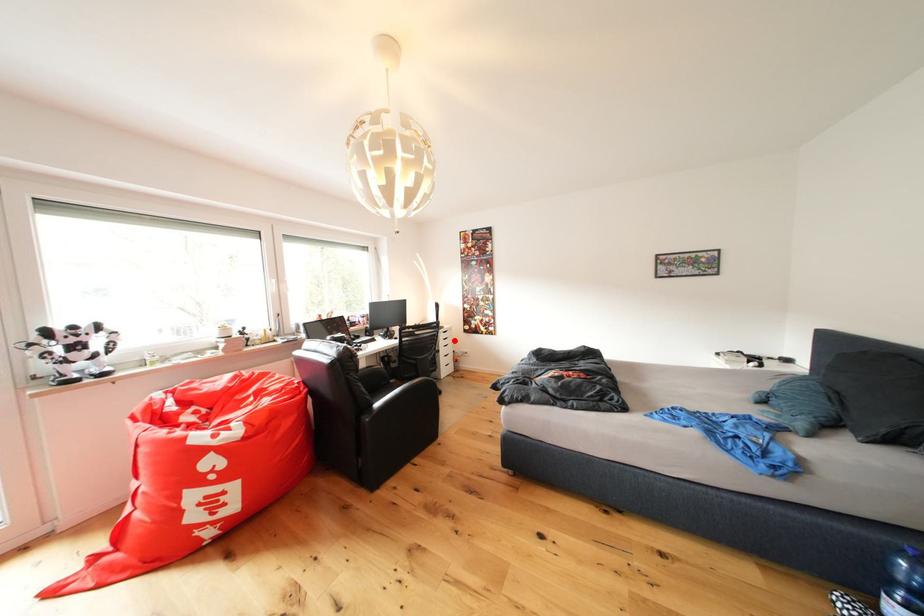
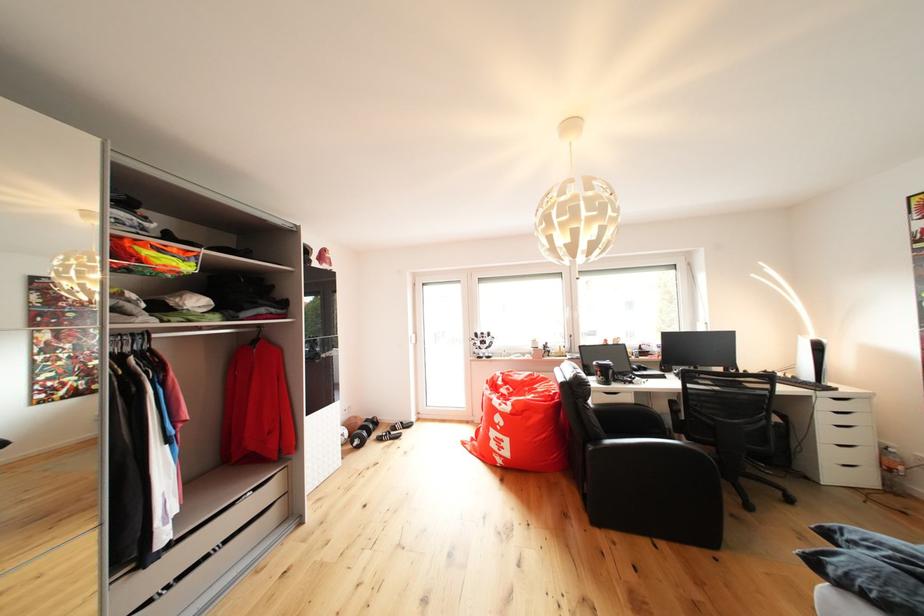
Question: I am providing you with two images of the same scene from different viewpoints. In image1, a red point is highlighted. Considering the same 3D point in image2, which of the following is correct?

Choices:
 (A) It is closer
 (B) It is farther

Answer: (A)